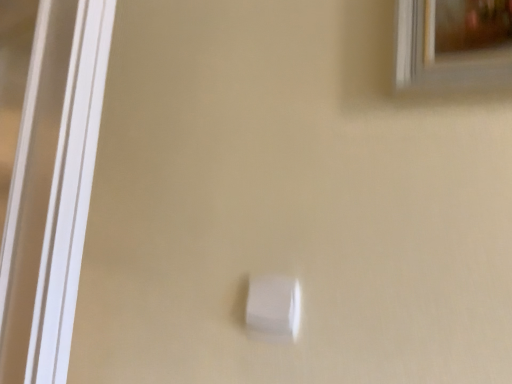
Question: Is matte gold frame at upper right taller or shorter than white plastic light switch at center?

Choices:
 (A) tall
 (B) short

Answer: (A)

Question: From the image's perspective, is matte gold frame at upper right above or below white plastic light switch at center?

Choices:
 (A) above
 (B) below

Answer: (A)

Question: Is point click(x=444, y=34) positioned closer to the camera than point click(x=258, y=284)?

Choices:
 (A) closer
 (B) farther

Answer: (A)

Question: Relative to matte gold frame at upper right, is white plastic light switch at center in front or behind?

Choices:
 (A) behind
 (B) front

Answer: (A)

Question: Would you say white plastic light switch at center is inside or outside matte gold frame at upper right?

Choices:
 (A) outside
 (B) inside

Answer: (A)

Question: Is point (251, 311) closer or farther from the camera than point (414, 16)?

Choices:
 (A) closer
 (B) farther

Answer: (B)

Question: In the image, is white plastic light switch at center on the left side or the right side of matte gold frame at upper right?

Choices:
 (A) left
 (B) right

Answer: (A)